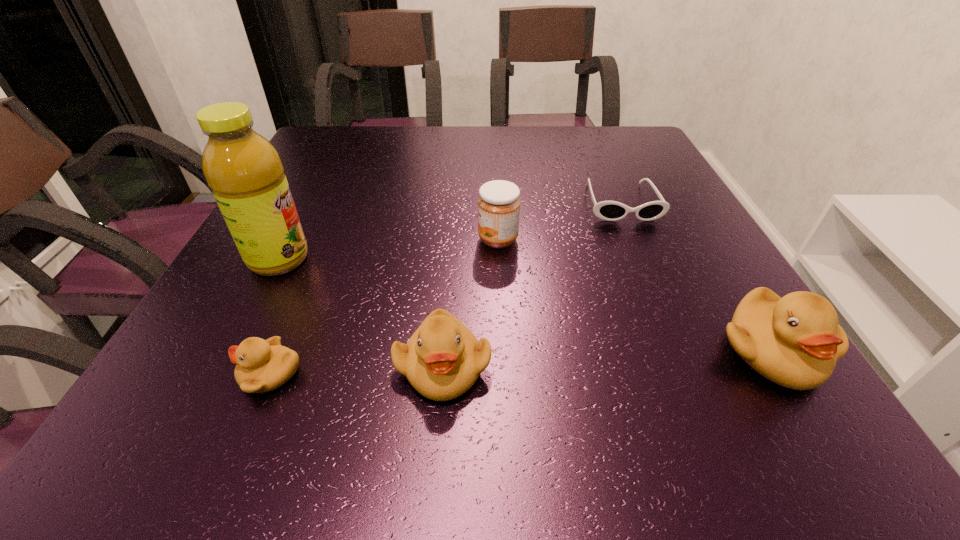
If the aim is uniform spacing by inserting an additional duckling among them, please point to a vacant space for this new duckling. Please provide its 2D coordinates. Your answer should be formatted as a tuple, i.e. [(x, y)], where the tuple contains the x and y coordinates of a point satisfying the conditions above.

[(610, 359)]